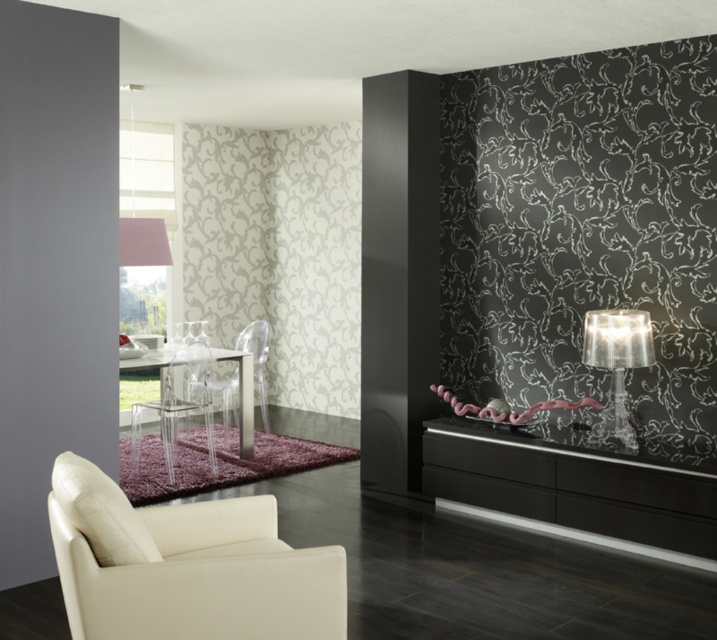
Question: Can you confirm if black glossy cabinet at lower right is thinner than transparent plastic chair at center?

Choices:
 (A) no
 (B) yes

Answer: (A)

Question: Among these points, which one is nearest to the camera?

Choices:
 (A) (85, 636)
 (B) (130, 348)

Answer: (A)

Question: Which of these objects is positioned closest to the clear glass table lamp at right?

Choices:
 (A) transparent plastic chair at center
 (B) black glossy cabinet at lower right
 (C) transparent plastic armchair at center
 (D) white fabric lampshade at upper left

Answer: (B)

Question: Which is nearer to the white leather couch at lower left?

Choices:
 (A) transparent plastic armchair at center
 (B) black glossy cabinet at lower right

Answer: (A)

Question: From the image, what is the correct spatial relationship of black glossy cabinet at lower right in relation to white fabric lampshade at upper left?

Choices:
 (A) above
 (B) below

Answer: (B)

Question: Does beige leather armchair at lower left appear on the left side of black glossy cabinet at lower right?

Choices:
 (A) no
 (B) yes

Answer: (B)